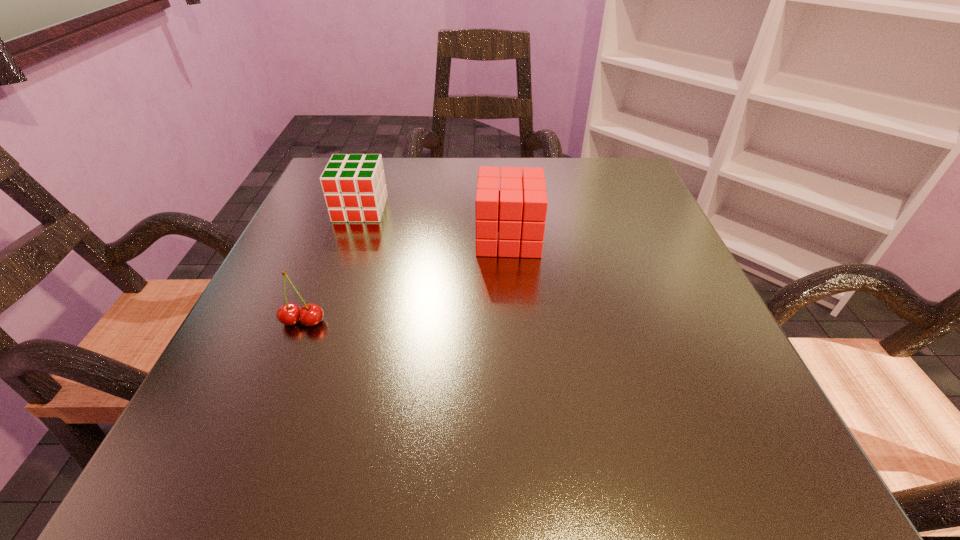
This screenshot has height=540, width=960. I want to click on vacant space that satisfies the following two spatial constraints: 1. on the red face of the right cube; 2. on the left side of the shorter cube, so click(x=350, y=238).

Where is `blank space that satisfies the following two spatial constraints: 1. on the red face of the right cube; 2. on the left side of the left cube`? This screenshot has width=960, height=540. blank space that satisfies the following two spatial constraints: 1. on the red face of the right cube; 2. on the left side of the left cube is located at coordinates (350, 238).

Locate an element on the screen. The width and height of the screenshot is (960, 540). blank space that satisfies the following two spatial constraints: 1. on the red face of the shorter cube; 2. on the left side of the taller cube is located at coordinates (350, 238).

In order to click on free spot that satisfies the following two spatial constraints: 1. on the red face of the left cube; 2. on the right side of the tallest object in this screenshot , I will do `click(350, 238)`.

Locate an element on the screen. vacant area in the image that satisfies the following two spatial constraints: 1. on the red face of the shorter cube; 2. on the right side of the tallest object is located at coordinates pyautogui.click(x=350, y=238).